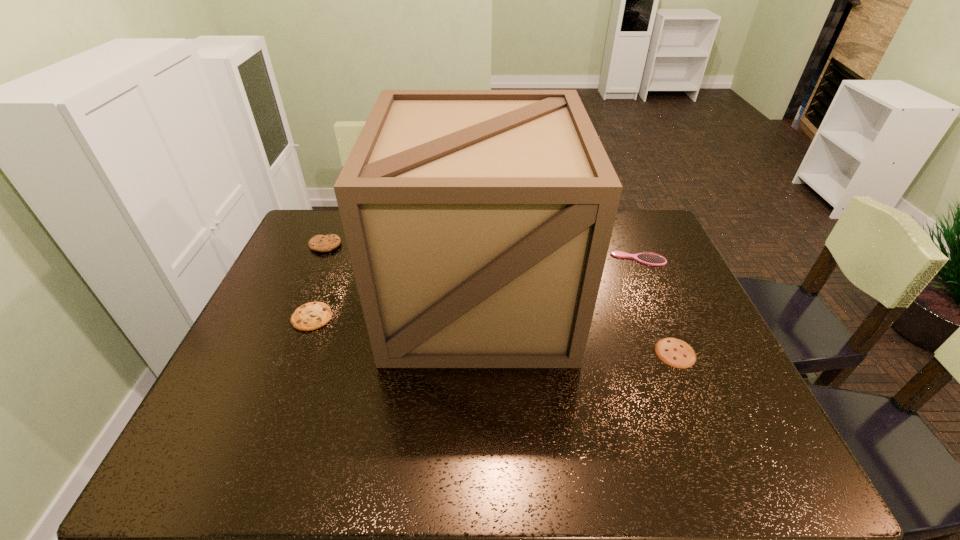
Locate an element on the screen. This screenshot has height=540, width=960. free location located on the front of the fourth shortest object is located at coordinates (302, 298).

Identify the location of free space located on the left of the hairbrush. The height and width of the screenshot is (540, 960). (596, 259).

Find the location of a particular element. The image size is (960, 540). vacant space located 0.400m on the right of the second farthest cookie is located at coordinates (478, 318).

The width and height of the screenshot is (960, 540). Find the location of `free point located 0.170m on the left of the nearest cookie`. free point located 0.170m on the left of the nearest cookie is located at coordinates (588, 353).

Find the location of a particular element. The image size is (960, 540). box that is at the far edge is located at coordinates (478, 222).

At what (x,y) coordinates should I click in order to perform the action: click on cookie that is positioned at the far edge. Please return your answer as a coordinate pair (x, y). The width and height of the screenshot is (960, 540). Looking at the image, I should click on [x=320, y=243].

I want to click on hairbrush that is positioned at the right edge, so click(648, 258).

I want to click on cookie at the right edge, so click(x=674, y=352).

At what (x,y) coordinates should I click in order to perform the action: click on object that is at the far left corner. Please return your answer as a coordinate pair (x, y). The width and height of the screenshot is (960, 540). Looking at the image, I should click on (320, 243).

This screenshot has width=960, height=540. I want to click on vacant space at the near edge of the desktop, so click(292, 467).